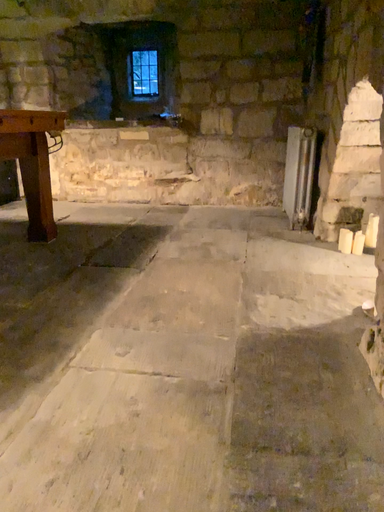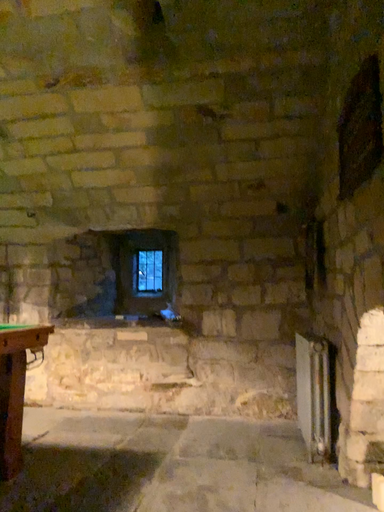
Question: Which way did the camera rotate in the video?

Choices:
 (A) rotated upward
 (B) rotated downward

Answer: (A)